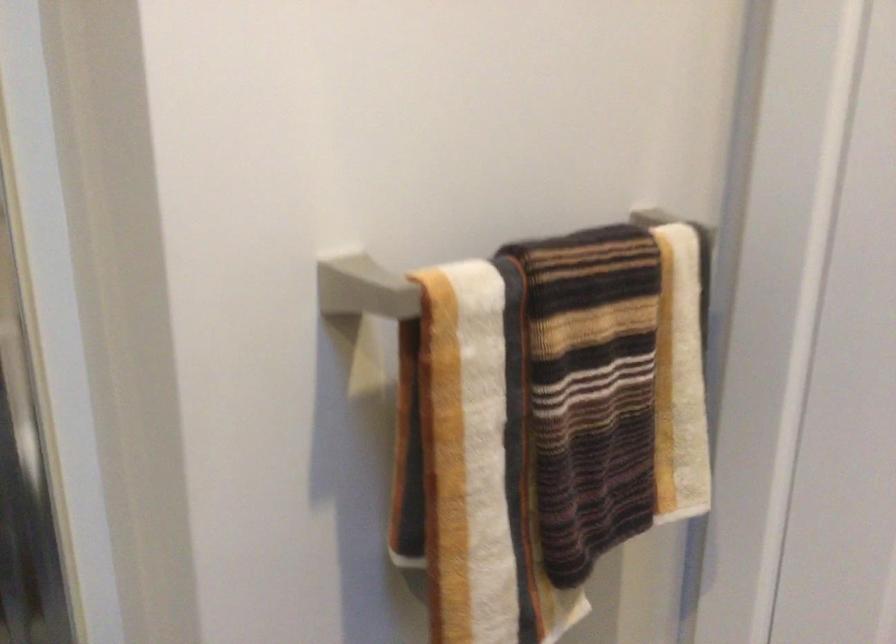
Locate an element on the screen. Image resolution: width=896 pixels, height=644 pixels. grey towel rack is located at coordinates (364, 288).